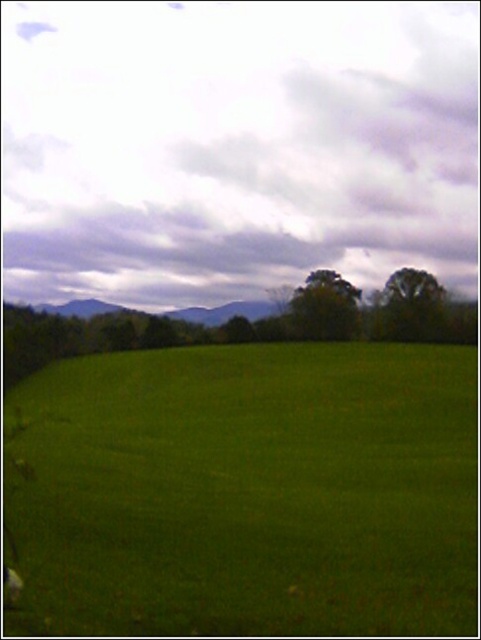
Which is more to the right, green grassy pasture at center or green leafy tree at center?

Positioned to the right is green leafy tree at center.

Can you confirm if green grassy pasture at center is taller than green leafy tree at center?

In fact, green grassy pasture at center may be shorter than green leafy tree at center.

Who is more distant from viewer, (311,509) or (325,321)?

Positioned behind is point (325,321).

Find the location of a particular element. Image resolution: width=481 pixels, height=640 pixels. green grassy pasture at center is located at coordinates (251, 492).

Which is more to the right, green grassy pasture at center or green leafy tree at right?

From the viewer's perspective, green leafy tree at right appears more on the right side.

Which is more to the left, green grassy pasture at center or green leafy tree at right?

From the viewer's perspective, green grassy pasture at center appears more on the left side.

Identify the location of green grassy pasture at center. The image size is (481, 640). (251, 492).

Identify the location of green leafy tree at right. point(412,305).

Is green leafy tree at right to the left of green leafy tree at center from the viewer's perspective?

In fact, green leafy tree at right is to the right of green leafy tree at center.

Which is in front, point (391, 326) or point (343, 321)?

Point (391, 326)

This screenshot has height=640, width=481. Identify the location of green leafy tree at right. pos(412,305).